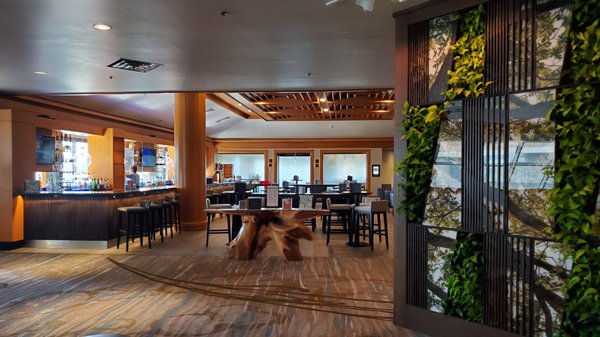
Where is `designs on the floor`? This screenshot has width=600, height=337. designs on the floor is located at coordinates (298, 293), (321, 281), (191, 313).